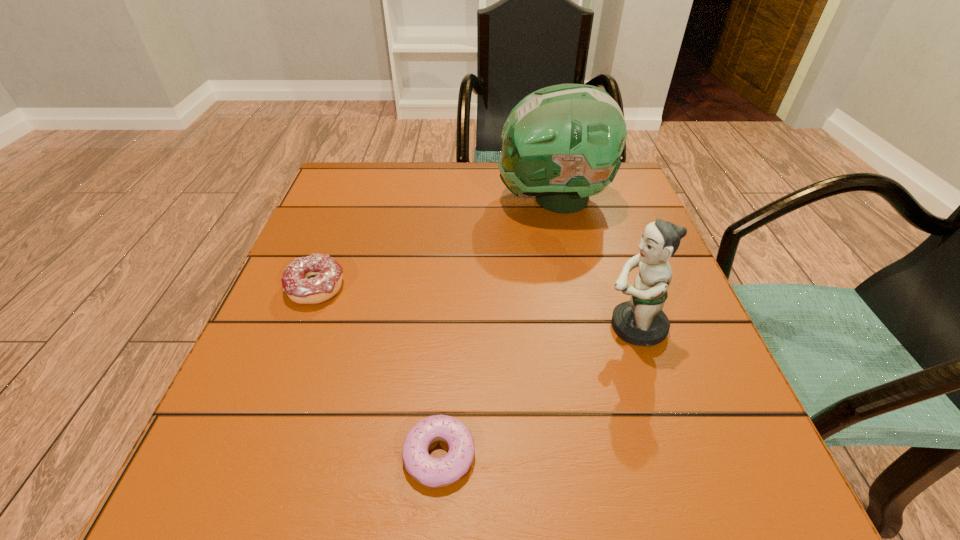
Where is `vacant space located 0.110m on the front-facing side of the third shortest object`? vacant space located 0.110m on the front-facing side of the third shortest object is located at coordinates (538, 327).

Find the location of a particular element. Image resolution: width=960 pixels, height=540 pixels. free space located 0.210m on the front-facing side of the third shortest object is located at coordinates (479, 327).

You are a GUI agent. You are given a task and a screenshot of the screen. Output one action in this format:
    pyautogui.click(x=<x>, y=<y>)
    Task: Click on the free location located on the front-facing side of the third shortest object
    This screenshot has height=540, width=960.
    Given the screenshot: What is the action you would take?
    pyautogui.click(x=432, y=327)

This screenshot has height=540, width=960. I want to click on vacant position located on the back of the leftmost object, so click(x=359, y=176).

I want to click on vacant space located 0.050m on the right of the shortest object, so click(x=513, y=455).

Image resolution: width=960 pixels, height=540 pixels. In order to click on object located in the far edge section of the desktop in this screenshot , I will do `click(562, 143)`.

The height and width of the screenshot is (540, 960). Find the location of `object that is positioned at the near edge`. object that is positioned at the near edge is located at coordinates (433, 472).

Identify the location of object present at the left edge. This screenshot has height=540, width=960. (327, 272).

The image size is (960, 540). In order to click on football helmet that is at the right edge in this screenshot , I will do `click(562, 143)`.

Locate an element on the screen. figurine at the right edge is located at coordinates (640, 321).